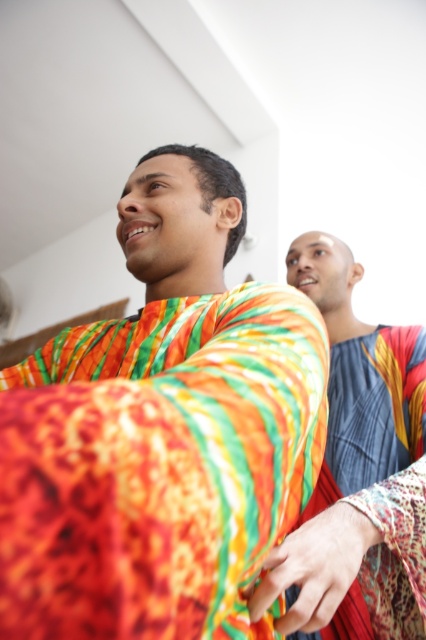
Question: Which of the following is the farthest from the observer?

Choices:
 (A) (359, 476)
 (B) (282, 413)

Answer: (A)

Question: In this image, where is textured vibrant shirt at center located relative to textured blue fabric at upper right?

Choices:
 (A) right
 (B) left

Answer: (B)

Question: Can you confirm if textured vibrant shirt at center is positioned below textured blue fabric at upper right?

Choices:
 (A) yes
 (B) no

Answer: (B)

Question: Does textured vibrant shirt at center have a larger size compared to textured blue fabric at upper right?

Choices:
 (A) yes
 (B) no

Answer: (B)

Question: Which of the following is the farthest from the observer?

Choices:
 (A) (347, 618)
 (B) (94, 328)

Answer: (B)

Question: Which object appears farthest from the camera in this image?

Choices:
 (A) textured blue fabric at upper right
 (B) textured vibrant shirt at center

Answer: (A)